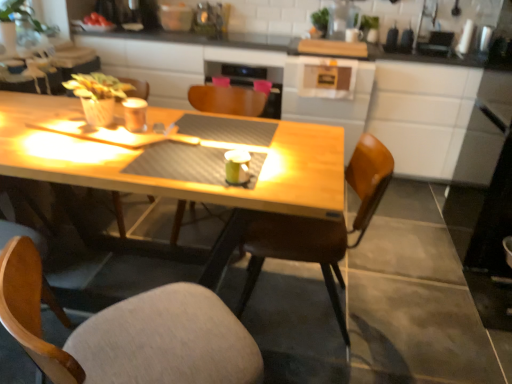
Find the location of a particular element. green leafy plant at upper left is located at coordinates (26, 16).

What do you see at coordinates (26, 16) in the screenshot? I see `green leafy plant at upper left` at bounding box center [26, 16].

What do you see at coordinates (130, 333) in the screenshot?
I see `wooden chair at lower center, acting as the 1th chair starting from the front` at bounding box center [130, 333].

Locate an element on the screen. wooden chair at lower center, acting as the 1th chair starting from the front is located at coordinates (130, 333).

What do you see at coordinates (229, 99) in the screenshot? The image size is (512, 384). I see `wooden chair at center, arranged as the third chair when viewed from the front` at bounding box center [229, 99].

Image resolution: width=512 pixels, height=384 pixels. Describe the element at coordinates (135, 114) in the screenshot. I see `matte metallic cup at center, placed as the 2th coffee cup when sorted from front to back` at that location.

Image resolution: width=512 pixels, height=384 pixels. I want to click on green leafy plant at upper left, so click(26, 16).

Does point (117, 69) lie in front of point (225, 163)?

No, it is behind (225, 163).

Between wooden table at center and green matte mug at center, marked as the second coffee cup in a back-to-front arrangement, which one has larger size?

wooden table at center is bigger.

Considering the relative sizes of wooden table at center and green matte mug at center, which is the first coffee cup in bottom-to-top order, in the image provided, is wooden table at center taller than green matte mug at center, which is the first coffee cup in bottom-to-top order,?

Yes.

Which of these two, matte metallic cup at center, which is the first coffee cup from top to bottom, or green matte mug at center, which is the second coffee cup from top to bottom, is wider?

matte metallic cup at center, which is the first coffee cup from top to bottom, is wider.

Measure the distance from matte metallic cup at center, arranged as the second coffee cup when ordered from the bottom, to green matte mug at center, which is the first coffee cup in bottom-to-top order.

The distance of matte metallic cup at center, arranged as the second coffee cup when ordered from the bottom, from green matte mug at center, which is the first coffee cup in bottom-to-top order, is 46.78 centimeters.

Can you see matte metallic cup at center, which is the second coffee cup in right-to-left order, touching green matte mug at center, marked as the second coffee cup in a back-to-front arrangement?

No, matte metallic cup at center, which is the second coffee cup in right-to-left order, is not making contact with green matte mug at center, marked as the second coffee cup in a back-to-front arrangement.

From the image's perspective, which object appears higher, matte metallic cup at center, which is the first coffee cup from top to bottom, or green matte mug at center, which is the second coffee cup from top to bottom?

matte metallic cup at center, which is the first coffee cup from top to bottom, from the image's perspective.

What's the angular difference between brown leather chair at center, positioned as the second chair in back-to-front order, and wooden chair at lower center, the third chair when ordered from back to front,'s facing directions?

The angle between the facing direction of brown leather chair at center, positioned as the second chair in back-to-front order, and the facing direction of wooden chair at lower center, the third chair when ordered from back to front, is 138 degrees.

Looking at this image, from the image's perspective, which one is positioned higher, brown leather chair at center, placed as the 2th chair when sorted from front to back, or wooden chair at lower center, acting as the 1th chair starting from the front?

brown leather chair at center, placed as the 2th chair when sorted from front to back, is shown above in the image.

From the picture: Is brown leather chair at center, positioned as the second chair in back-to-front order, oriented towards wooden chair at lower center, acting as the 1th chair starting from the front?

No, brown leather chair at center, positioned as the second chair in back-to-front order, is not aimed at wooden chair at lower center, acting as the 1th chair starting from the front.

Which object is more forward, brown leather chair at center, placed as the 2th chair when sorted from front to back, or wooden chair at lower center, acting as the 1th chair starting from the front?

wooden chair at lower center, acting as the 1th chair starting from the front, is more forward.

Considering the sizes of green leafy plant at upper left and wooden chair at center, the first chair in the back-to-front sequence, in the image, is green leafy plant at upper left wider or thinner than wooden chair at center, the first chair in the back-to-front sequence,?

In the image, green leafy plant at upper left appears to be more narrow than wooden chair at center, the first chair in the back-to-front sequence.

Which is behind, green leafy plant at upper left or wooden chair at center, the first chair in the back-to-front sequence?

green leafy plant at upper left.

From a real-world perspective, is green leafy plant at upper left on top of wooden chair at center, the first chair in the back-to-front sequence?

Yes, from a real-world perspective, green leafy plant at upper left is over wooden chair at center, the first chair in the back-to-front sequence

Which of these two, green leafy plant at upper left or wooden chair at center, the first chair in the back-to-front sequence, is smaller?

green leafy plant at upper left.

Does brown leather chair at center, positioned as the second chair in back-to-front order, have a greater width compared to matte metallic cup at center, marked as the first coffee cup in a back-to-front arrangement?

Yes.

In the scene shown: Is brown leather chair at center, placed as the 2th chair when sorted from front to back, spatially inside matte metallic cup at center, which is the second coffee cup in right-to-left order, or outside of it?

brown leather chair at center, placed as the 2th chair when sorted from front to back, is spatially situated outside matte metallic cup at center, which is the second coffee cup in right-to-left order.

How much distance is there between brown leather chair at center, positioned as the second chair in back-to-front order, and matte metallic cup at center, which is the second coffee cup in right-to-left order?

brown leather chair at center, positioned as the second chair in back-to-front order, and matte metallic cup at center, which is the second coffee cup in right-to-left order, are 32.18 inches apart.

What's the angular difference between wooden chair at lower center, acting as the 1th chair starting from the front, and green matte mug at center, which appears as the first coffee cup when viewed from the right,'s facing directions?

They differ by 135 degrees in their facing directions.

The height and width of the screenshot is (384, 512). What are the coordinates of `chair that is the 2nd one when counting downward from the green matte mug at center, acting as the second coffee cup starting from the left (from the image's perspective)` in the screenshot? It's located at (130, 333).

Is wooden chair at lower center, acting as the 1th chair starting from the front, wider or thinner than green matte mug at center, which is counted as the 1th coffee cup, starting from the front?

In the image, wooden chair at lower center, acting as the 1th chair starting from the front, appears to be wider than green matte mug at center, which is counted as the 1th coffee cup, starting from the front.

Do you think wooden chair at lower center, acting as the 1th chair starting from the front, is within green matte mug at center, acting as the second coffee cup starting from the left, or outside of it?

wooden chair at lower center, acting as the 1th chair starting from the front, cannot be found inside green matte mug at center, acting as the second coffee cup starting from the left.

Is wooden chair at lower center, the third chair when ordered from back to front, facing towards wooden chair at center, the first chair in the back-to-front sequence?

No, wooden chair at lower center, the third chair when ordered from back to front, is not facing towards wooden chair at center, the first chair in the back-to-front sequence.

Where is `the 2nd chair below the wooden chair at center, arranged as the third chair when viewed from the front (from the image's perspective)`? The image size is (512, 384). the 2nd chair below the wooden chair at center, arranged as the third chair when viewed from the front (from the image's perspective) is located at coordinates (130, 333).

Based on their sizes in the image, would you say wooden chair at lower center, the third chair when ordered from back to front, is bigger or smaller than wooden chair at center, arranged as the third chair when viewed from the front?

Considering their sizes, wooden chair at lower center, the third chair when ordered from back to front, takes up less space than wooden chair at center, arranged as the third chair when viewed from the front.

In the scene shown: Which is more to the left, wooden chair at lower center, the third chair when ordered from back to front, or wooden chair at center, the first chair in the back-to-front sequence?

Positioned to the left is wooden chair at lower center, the third chair when ordered from back to front.

Locate an element on the screen. Image resolution: width=512 pixels, height=384 pixels. counter above the green matte mug at center, which appears as the first coffee cup when viewed from the right (from the image's perspective) is located at coordinates pos(350,102).

The height and width of the screenshot is (384, 512). What are the coordinates of `coffee cup behind the green matte mug at center, which is the second coffee cup from top to bottom` in the screenshot? It's located at (135, 114).

When comparing their distances from wooden table at center, does matte metallic cup at center, arranged as the second coffee cup when ordered from the bottom, or green matte mug at center, which is the first coffee cup in bottom-to-top order, seem closer?

matte metallic cup at center, arranged as the second coffee cup when ordered from the bottom, is positioned closer to the anchor wooden table at center.

Considering their positions, is brown leather chair at center, positioned as the second chair in back-to-front order, positioned closer to wooden table at center than wooden chair at lower center, the third chair when ordered from back to front?

brown leather chair at center, positioned as the second chair in back-to-front order.

Looking at the image, which one is located closer to wooden table at center, green matte mug at center, which is the first coffee cup in bottom-to-top order, or wooden chair at lower center, acting as the 1th chair starting from the front?

green matte mug at center, which is the first coffee cup in bottom-to-top order, is positioned closer to the anchor wooden table at center.

Which object lies nearer to the anchor point brown leather chair at center, placed as the 2th chair when sorted from front to back, green matte mug at center, marked as the second coffee cup in a back-to-front arrangement, or wooden chair at lower center, acting as the 1th chair starting from the front?

green matte mug at center, marked as the second coffee cup in a back-to-front arrangement, lies closer to brown leather chair at center, placed as the 2th chair when sorted from front to back, than the other object.

Looking at the image, which one is located further to matte metallic cup at center, placed as the 2th coffee cup when sorted from front to back, wooden chair at lower center, acting as the 1th chair starting from the front, or green leafy plant at upper left?

Among the two, green leafy plant at upper left is located further to matte metallic cup at center, placed as the 2th coffee cup when sorted from front to back.

Looking at the image, which one is located closer to green matte mug at center, which is the second coffee cup from top to bottom, wooden chair at lower center, the third chair when ordered from back to front, or matte metallic cup at center, arranged as the second coffee cup when ordered from the bottom?

matte metallic cup at center, arranged as the second coffee cup when ordered from the bottom.

Estimate the real-world distances between objects in this image. Which object is further from green leafy plant at upper left, wooden chair at lower center, the third chair when ordered from back to front, or brown leather chair at center, positioned as the second chair in back-to-front order?

Based on the image, wooden chair at lower center, the third chair when ordered from back to front, appears to be further to green leafy plant at upper left.

Looking at the image, which one is located further to wooden chair at lower center, acting as the 1th chair starting from the front, wooden table at center or brown leather chair at center, placed as the 2th chair when sorted from front to back?

wooden table at center lies further to wooden chair at lower center, acting as the 1th chair starting from the front, than the other object.

Locate an element on the screen. This screenshot has width=512, height=384. chair between brown leather chair at center, positioned as the second chair in back-to-front order, and wooden table at center in the front-back direction is located at coordinates (229, 99).

The image size is (512, 384). In order to click on coffee cup between green leafy plant at upper left and green matte mug at center, which is the first coffee cup in bottom-to-top order in this screenshot , I will do `click(135, 114)`.

This screenshot has height=384, width=512. Identify the location of chair located between wooden chair at lower center, the third chair when ordered from back to front, and wooden chair at center, arranged as the third chair when viewed from the front, in the depth direction. (320, 227).

At what (x,y) coordinates should I click in order to perform the action: click on coffee cup between brown leather chair at center, placed as the 2th chair when sorted from front to back, and wooden table at center from front to back. Please return your answer as a coordinate pair (x, y). The image size is (512, 384). Looking at the image, I should click on (135, 114).